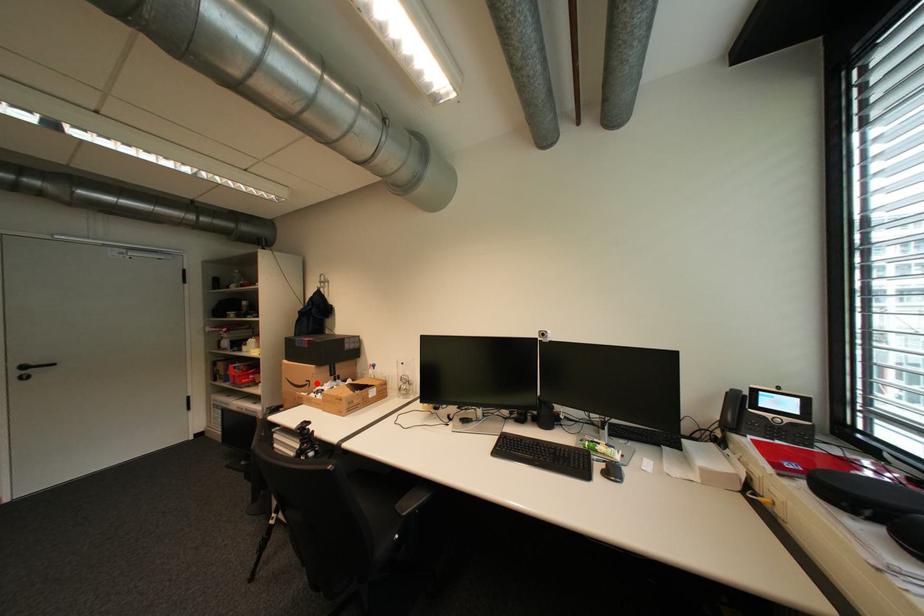
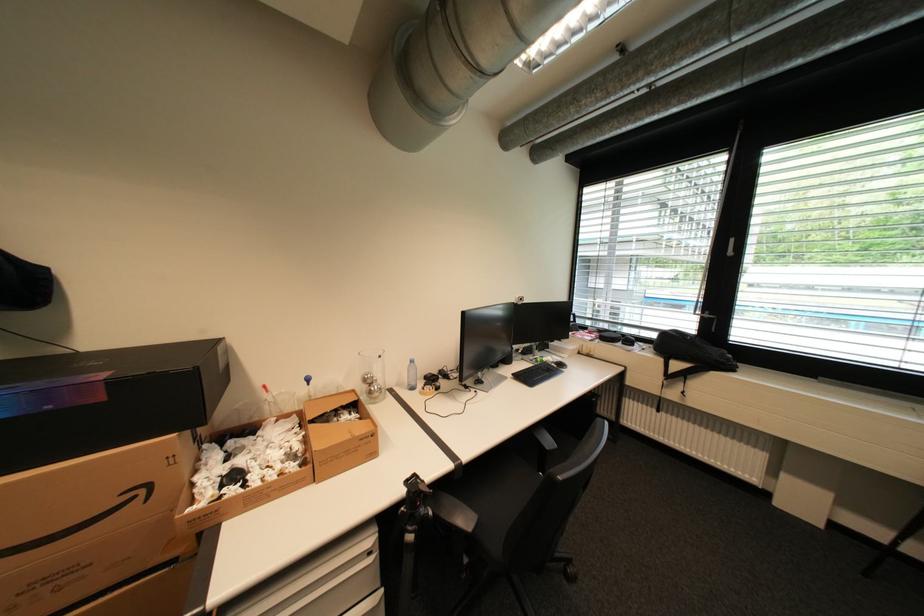
Question: A red point is marked in image1. In image2, is the corresponding 3D point closer to the camera or farther? Reply with the corresponding letter.

Choices:
 (A) The corresponding 3D point is closer.
 (B) The corresponding 3D point is farther.

Answer: (A)